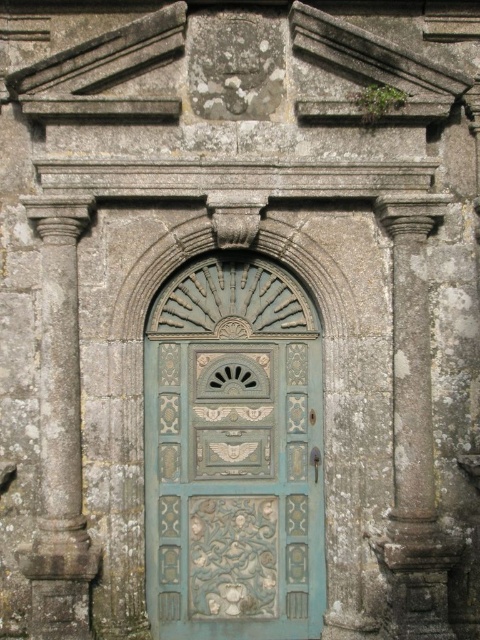
Question: Among these points, which one is farthest from the camera?

Choices:
 (A) (47, 454)
 (B) (151, 426)

Answer: (B)

Question: Is blue carved door at center to the left of gray stone column at left from the viewer's perspective?

Choices:
 (A) no
 (B) yes

Answer: (A)

Question: Which object is farther from the camera taking this photo?

Choices:
 (A) gray stone column at right
 (B) blue carved door at center

Answer: (B)

Question: Is gray stone column at right thinner than gray stone column at left?

Choices:
 (A) no
 (B) yes

Answer: (B)

Question: Where is blue carved door at center located in relation to gray stone column at left in the image?

Choices:
 (A) right
 (B) left

Answer: (A)

Question: Which object appears farthest from the camera in this image?

Choices:
 (A) gray stone column at left
 (B) gray stone column at right
 (C) blue carved door at center

Answer: (C)